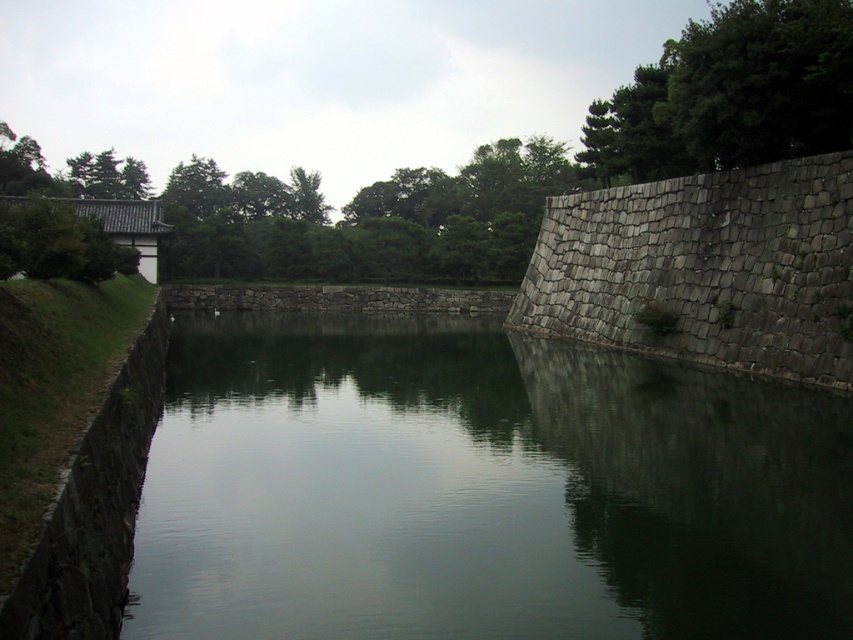
From the picture: Does green stone wall at center appear on the right side of dark gray stone moat at left?

Indeed, green stone wall at center is positioned on the right side of dark gray stone moat at left.

Is green stone wall at center below dark gray stone moat at left?

Yes, green stone wall at center is below dark gray stone moat at left.

At what (x,y) coordinates should I click in order to perform the action: click on green stone wall at center. Please return your answer as a coordinate pair (x, y). Image resolution: width=853 pixels, height=640 pixels. Looking at the image, I should click on (480, 490).